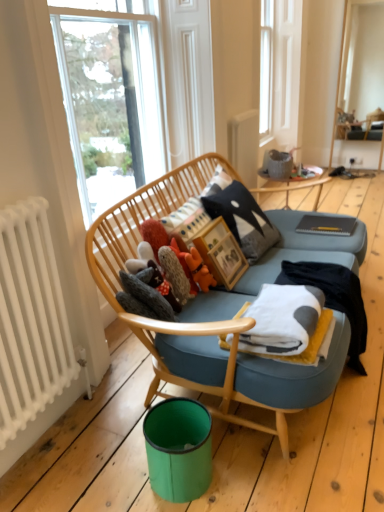
Question: From a real-world perspective, is teal plastic bin at lower center above or below fluffy orange toy at center, acting as the 3th toy starting from the left?

Choices:
 (A) above
 (B) below

Answer: (B)

Question: In the image, is teal plastic bin at lower center on the left side or the right side of fluffy orange toy at center, acting as the 3th toy starting from the left?

Choices:
 (A) right
 (B) left

Answer: (B)

Question: Based on their relative distances, which object is farther from the white soft fabric at right?

Choices:
 (A) wooden picture frame at center
 (B) fluffy fabric stuffed animals at center, which is the second toy in left-to-right order
 (C) fuzzy gray stuffed animal at center, the first toy when ordered from left to right
 (D) wooden table at center
 (E) black felt pillow at center

Answer: (D)

Question: Which of these objects is positioned farthest from the wooden table at center?

Choices:
 (A) white radiator at left
 (B) black felt pillow at center
 (C) fluffy fabric stuffed animals at center, which is the second toy in left-to-right order
 (D) matte gray notebook at center
 (E) matte gray vase at upper center

Answer: (A)